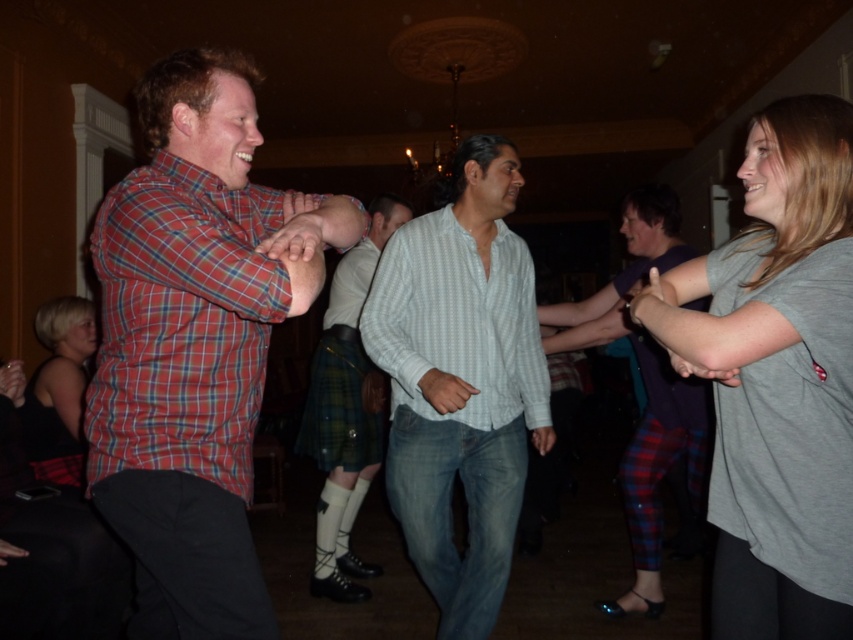
Question: Among these points, which one is nearest to the camera?

Choices:
 (A) (427, 227)
 (B) (189, 220)
 (C) (718, 547)
 (D) (45, 428)

Answer: (B)

Question: Which point appears farthest from the camera in this image?

Choices:
 (A) (163, 388)
 (B) (608, 323)
 (C) (503, 538)

Answer: (B)

Question: Is green plaid kilt at center closer to camera compared to matte black tank top at lower left?

Choices:
 (A) yes
 (B) no

Answer: (B)

Question: Is the position of green plaid kilt at center more distant than that of matte black tank top at lower left?

Choices:
 (A) yes
 (B) no

Answer: (A)

Question: Estimate the real-world distances between objects in this image. Which object is closer to the matte black tank top at lower left?

Choices:
 (A) light gray striped shirt at center
 (B) gray cotton t-shirt at right
 (C) plaid fabric pants at center

Answer: (A)

Question: Is plaid fabric pants at center bigger than green plaid kilt at center?

Choices:
 (A) no
 (B) yes

Answer: (B)